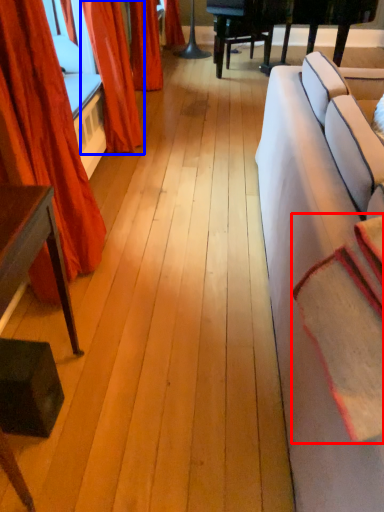
Question: Among these objects, which one is farthest to the camera, blanket (highlighted by a red box) or curtain (highlighted by a blue box)?

Choices:
 (A) blanket
 (B) curtain

Answer: (B)